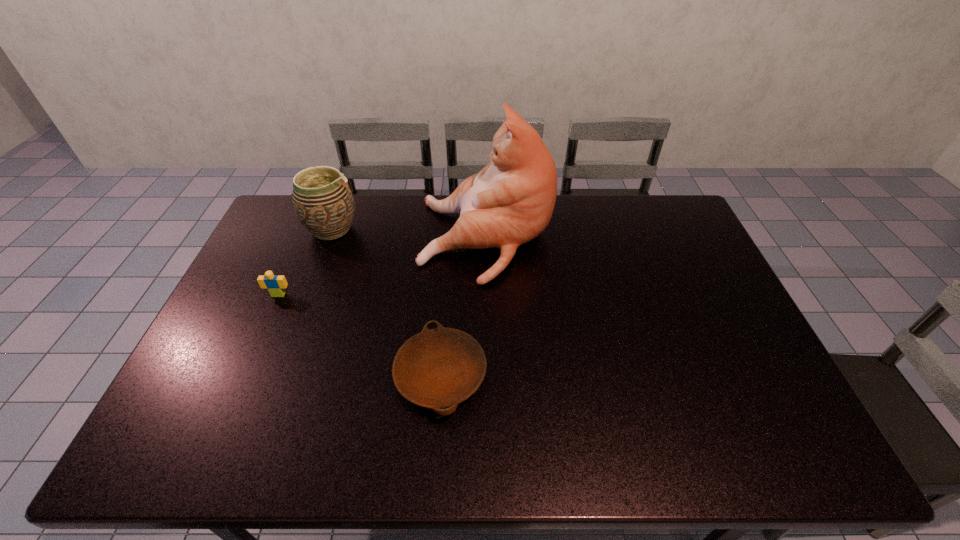
At what (x,y) coordinates should I click in order to perform the action: click on free space at the right edge of the desktop. Please return your answer as a coordinate pair (x, y). The width and height of the screenshot is (960, 540). Looking at the image, I should click on (723, 295).

In order to click on free space that is in between the tallest object and the nearest object in this screenshot , I will do `click(464, 308)`.

I want to click on free area in between the shortest object and the tallest object, so click(464, 308).

Locate an element on the screen. This screenshot has width=960, height=540. vacant region between the plate and the second tallest object is located at coordinates click(386, 302).

Image resolution: width=960 pixels, height=540 pixels. In order to click on vacant point located between the second shortest object and the pottery in this screenshot , I will do click(305, 262).

The image size is (960, 540). In order to click on vacant region between the second tallest object and the nearest object in this screenshot , I will do `click(386, 302)`.

At what (x,y) coordinates should I click in order to perform the action: click on free space between the plate and the cat. Please return your answer as a coordinate pair (x, y). The width and height of the screenshot is (960, 540). Looking at the image, I should click on (464, 308).

I want to click on free spot between the cat and the second tallest object, so click(409, 235).

Find the location of a particular element. free space between the nearest object and the cat is located at coordinates (464, 308).

Where is `vacant space that's between the cat and the nearest object`? This screenshot has height=540, width=960. vacant space that's between the cat and the nearest object is located at coordinates (x=464, y=308).